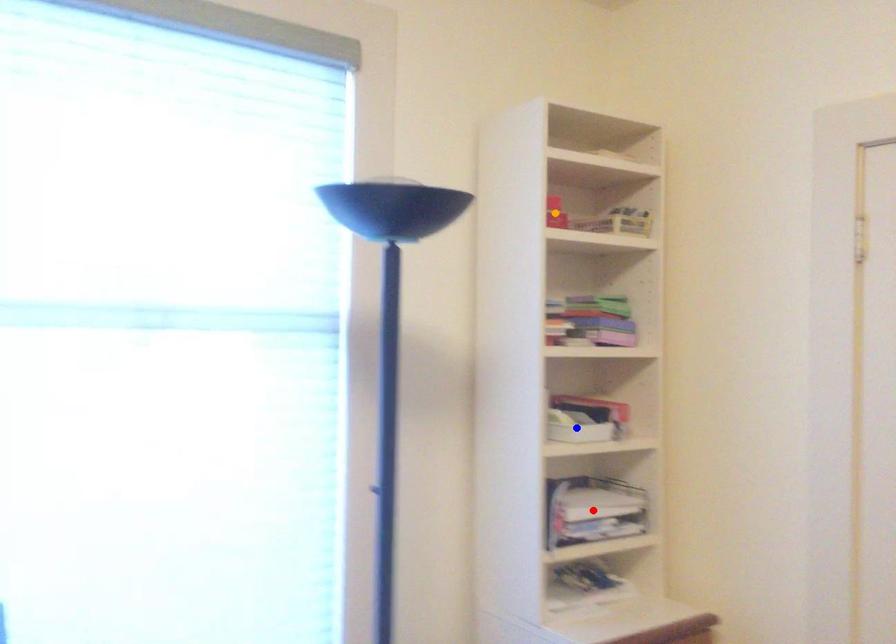
Order these from nearest to farthest:
- blue point
- red point
- orange point

1. blue point
2. orange point
3. red point